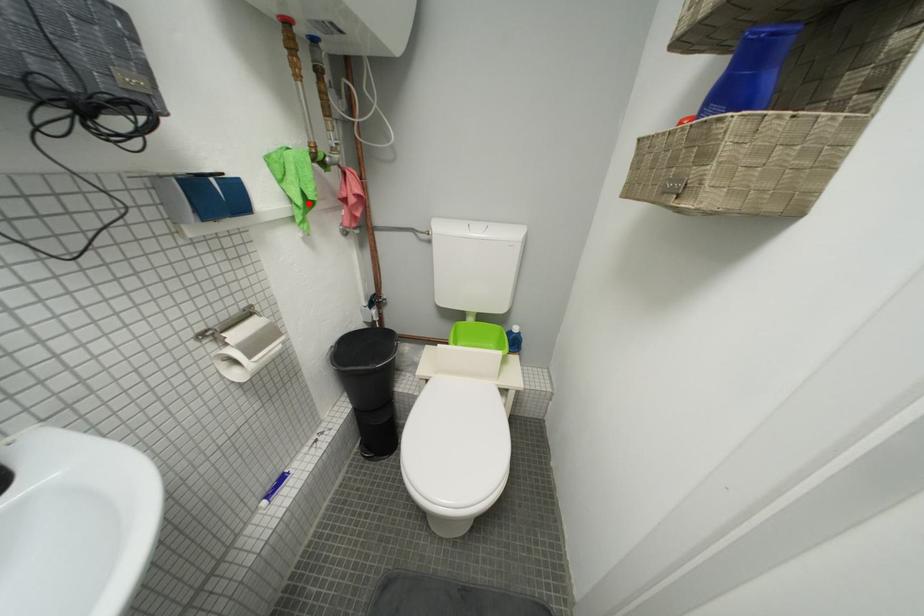
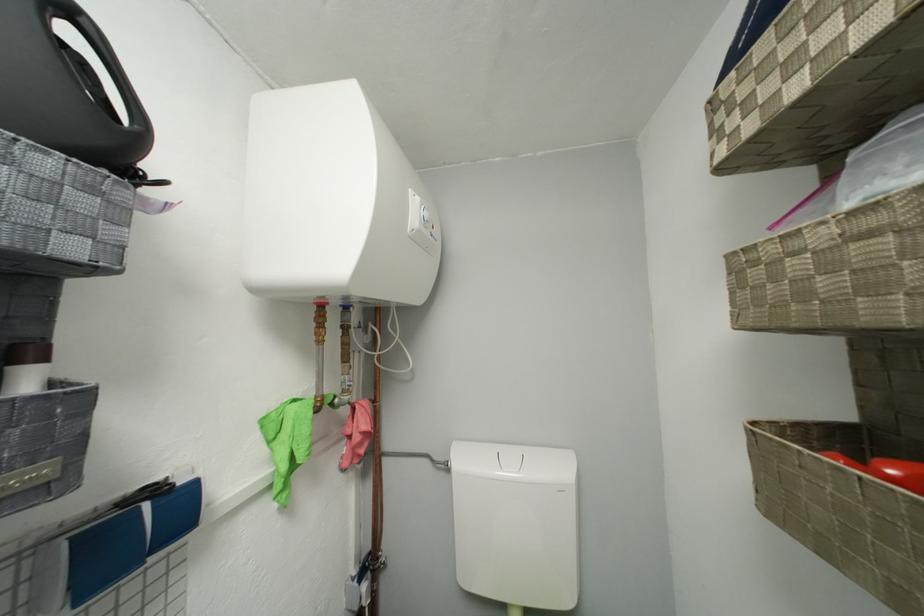
Question: A red point is marked in image1. In image2, is the corresponding 3D point closer to the camera or farther? Reply with the corresponding letter.

Choices:
 (A) The corresponding 3D point is closer.
 (B) The corresponding 3D point is farther.

Answer: (B)